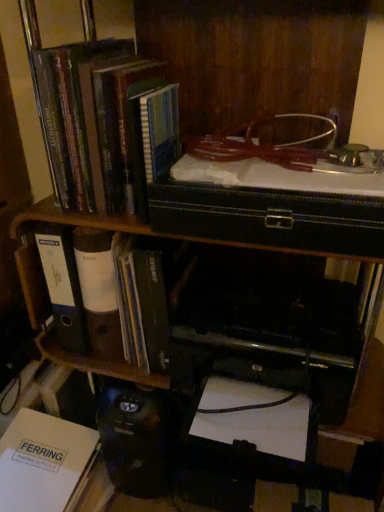
Consider the image. Measure the distance between black plastic printer at lower center and camera.

The distance of black plastic printer at lower center from camera is 29.74 inches.

What do you see at coordinates (143, 298) in the screenshot? The width and height of the screenshot is (384, 512). I see `white paper folder at left, positioned as the 2th book in bottom-to-top order` at bounding box center [143, 298].

Locate an element on the screen. The height and width of the screenshot is (512, 384). white paper at lower left, placed as the 1th book when sorted from bottom to top is located at coordinates (42, 462).

From a real-world perspective, which object stands above the other?

white paper folder at left, the 2th book in the top-to-bottom sequence.

From the picture: Which is correct: white paper folder at left, the 2th book in the top-to-bottom sequence, is inside white paper at lower left, placed as the 1th book when sorted from bottom to top, or outside of it?

white paper folder at left, the 2th book in the top-to-bottom sequence, is not inside white paper at lower left, placed as the 1th book when sorted from bottom to top, it's outside.

From the image's perspective, between white paper folder at left, positioned as the 2th book in bottom-to-top order, and white paper at lower left, placed as the 1th book when sorted from bottom to top, which one is located above?

white paper folder at left, positioned as the 2th book in bottom-to-top order.

From a real-world perspective, relative to white paper at lower left, positioned as the 3th book in top-to-bottom order, is hardcover book at upper left, which is the first book from top to bottom, vertically above or below?

Clearly, from a real-world perspective, hardcover book at upper left, which is the first book from top to bottom, is above white paper at lower left, positioned as the 3th book in top-to-bottom order.

Is hardcover book at upper left, which is the first book from top to bottom, oriented towards white paper at lower left, positioned as the 3th book in top-to-bottom order?

No, hardcover book at upper left, which is the first book from top to bottom, is not oriented towards white paper at lower left, positioned as the 3th book in top-to-bottom order.

From the image's perspective, is hardcover book at upper left, the third book ordered from the bottom, above white paper at lower left, positioned as the 3th book in top-to-bottom order?

Yes, from the image's perspective, hardcover book at upper left, the third book ordered from the bottom, is above white paper at lower left, positioned as the 3th book in top-to-bottom order.

Between hardcover book at upper left, which is the first book from top to bottom, and white paper at lower left, placed as the 1th book when sorted from bottom to top, which one appears on the left side from the viewer's perspective?

From the viewer's perspective, white paper at lower left, placed as the 1th book when sorted from bottom to top, appears more on the left side.

Is black plastic printer at lower center facing towards white paper folder at left, positioned as the 2th book in bottom-to-top order?

No, black plastic printer at lower center is not aimed at white paper folder at left, positioned as the 2th book in bottom-to-top order.

Identify the location of printer that appears in front of the white paper folder at left, positioned as the 2th book in bottom-to-top order. The height and width of the screenshot is (512, 384). (268, 337).

Is black plastic printer at lower center wider or thinner than white paper folder at left, the 2th book in the top-to-bottom sequence?

Clearly, black plastic printer at lower center has more width compared to white paper folder at left, the 2th book in the top-to-bottom sequence.

Identify the location of the 2nd book in front of the white paper at lower left, positioned as the 3th book in top-to-bottom order, counting from the anchor's position. The image size is (384, 512). (85, 121).

Looking at their sizes, would you say white paper at lower left, positioned as the 3th book in top-to-bottom order, is wider or thinner than hardcover book at upper left, the third book ordered from the bottom?

In the image, white paper at lower left, positioned as the 3th book in top-to-bottom order, appears to be more narrow than hardcover book at upper left, the third book ordered from the bottom.

Does point (41, 478) appear closer or farther from the camera than point (138, 65)?

Clearly, point (41, 478) is more distant from the camera than point (138, 65).

Can you tell me how much white paper at lower left, placed as the 1th book when sorted from bottom to top, and hardcover book at upper left, the third book ordered from the bottom, differ in facing direction?

white paper at lower left, placed as the 1th book when sorted from bottom to top, and hardcover book at upper left, the third book ordered from the bottom, are facing 7.06 degrees away from each other.

Is white paper folder at left, the 2th book in the top-to-bottom sequence, shorter than black plastic printer at lower center?

No, white paper folder at left, the 2th book in the top-to-bottom sequence, is not shorter than black plastic printer at lower center.

This screenshot has width=384, height=512. Find the location of `book that is the 1st one when counting upward from the black plastic printer at lower center (from the image's perspective)`. book that is the 1st one when counting upward from the black plastic printer at lower center (from the image's perspective) is located at coordinates (143, 298).

Which object is closer to the camera taking this photo, white paper folder at left, the 2th book in the top-to-bottom sequence, or black plastic printer at lower center?

black plastic printer at lower center is more forward.

Considering the relative sizes of white paper folder at left, positioned as the 2th book in bottom-to-top order, and black plastic printer at lower center in the image provided, is white paper folder at left, positioned as the 2th book in bottom-to-top order, bigger than black plastic printer at lower center?

Incorrect, white paper folder at left, positioned as the 2th book in bottom-to-top order, is not larger than black plastic printer at lower center.

Is hardcover book at upper left, the third book ordered from the bottom, to the left of white paper folder at left, the 2th book in the top-to-bottom sequence, from the viewer's perspective?

Incorrect, hardcover book at upper left, the third book ordered from the bottom, is not on the left side of white paper folder at left, the 2th book in the top-to-bottom sequence.

Is the depth of hardcover book at upper left, the third book ordered from the bottom, less than that of white paper folder at left, positioned as the 2th book in bottom-to-top order?

Yes.

Can you confirm if hardcover book at upper left, which is the first book from top to bottom, is wider than white paper folder at left, the 2th book in the top-to-bottom sequence?

No.

Considering the relative sizes of hardcover book at upper left, the third book ordered from the bottom, and white paper folder at left, positioned as the 2th book in bottom-to-top order, in the image provided, is hardcover book at upper left, the third book ordered from the bottom, taller than white paper folder at left, positioned as the 2th book in bottom-to-top order,?

Indeed, hardcover book at upper left, the third book ordered from the bottom, has a greater height compared to white paper folder at left, positioned as the 2th book in bottom-to-top order.

Which is further, (189, 379) or (70, 431)?

Point (70, 431)

Which object is positioned more to the right, black plastic printer at lower center or white paper at lower left, placed as the 1th book when sorted from bottom to top?

black plastic printer at lower center.

The width and height of the screenshot is (384, 512). I want to click on the 2nd book behind the black plastic printer at lower center, starting your count from the anchor, so click(x=42, y=462).

Is black plastic printer at lower center not within white paper at lower left, positioned as the 3th book in top-to-bottom order?

black plastic printer at lower center is positioned outside white paper at lower left, positioned as the 3th book in top-to-bottom order.

Identify the location of book below the white paper folder at left, the 2th book in the top-to-bottom sequence (from a real-world perspective). This screenshot has height=512, width=384. (42, 462).

From the white paper at lower left, placed as the 1th book when sorted from bottom to top, count 2nd books forward and point to it. Please provide its 2D coordinates.

[(85, 121)]

Considering their positions, is white paper at lower left, placed as the 1th book when sorted from bottom to top, positioned closer to white paper folder at left, the 2th book in the top-to-bottom sequence, than black plastic printer at lower center?

black plastic printer at lower center is positioned closer to the anchor white paper folder at left, the 2th book in the top-to-bottom sequence.

Based on their spatial positions, is white paper folder at left, the 2th book in the top-to-bottom sequence, or black plastic printer at lower center further from white paper at lower left, positioned as the 3th book in top-to-bottom order?

Among the two, black plastic printer at lower center is located further to white paper at lower left, positioned as the 3th book in top-to-bottom order.

Which object lies further to the anchor point hardcover book at upper left, which is the first book from top to bottom, white paper at lower left, positioned as the 3th book in top-to-bottom order, or white paper folder at left, the 2th book in the top-to-bottom sequence?

white paper at lower left, positioned as the 3th book in top-to-bottom order.

From the image, which object appears to be farther from white paper at lower left, placed as the 1th book when sorted from bottom to top, hardcover book at upper left, the third book ordered from the bottom, or white paper folder at left, positioned as the 2th book in bottom-to-top order?

The object further to white paper at lower left, placed as the 1th book when sorted from bottom to top, is hardcover book at upper left, the third book ordered from the bottom.

Based on the photo, estimate the real-world distances between objects in this image. Which object is closer to white paper folder at left, the 2th book in the top-to-bottom sequence, black plastic printer at lower center or hardcover book at upper left, which is the first book from top to bottom?

Based on the image, black plastic printer at lower center appears to be nearer to white paper folder at left, the 2th book in the top-to-bottom sequence.

From the image, which object appears to be nearer to black plastic printer at lower center, hardcover book at upper left, which is the first book from top to bottom, or white paper folder at left, the 2th book in the top-to-bottom sequence?

Based on the image, white paper folder at left, the 2th book in the top-to-bottom sequence, appears to be nearer to black plastic printer at lower center.

Considering their positions, is hardcover book at upper left, which is the first book from top to bottom, positioned closer to white paper folder at left, positioned as the 2th book in bottom-to-top order, than black plastic printer at lower center?

Based on the image, black plastic printer at lower center appears to be nearer to white paper folder at left, positioned as the 2th book in bottom-to-top order.

From the image, which object appears to be farther from white paper at lower left, positioned as the 3th book in top-to-bottom order, hardcover book at upper left, the third book ordered from the bottom, or black plastic printer at lower center?

hardcover book at upper left, the third book ordered from the bottom, is positioned further to the anchor white paper at lower left, positioned as the 3th book in top-to-bottom order.

Where is `printer between hardcover book at upper left, which is the first book from top to bottom, and white paper at lower left, placed as the 1th book when sorted from bottom to top, vertically`? The width and height of the screenshot is (384, 512). printer between hardcover book at upper left, which is the first book from top to bottom, and white paper at lower left, placed as the 1th book when sorted from bottom to top, vertically is located at coordinates (268, 337).

Identify the location of book between hardcover book at upper left, which is the first book from top to bottom, and black plastic printer at lower center from top to bottom. (143, 298).

Locate an element on the screen. book that lies between hardcover book at upper left, which is the first book from top to bottom, and white paper at lower left, positioned as the 3th book in top-to-bottom order, from top to bottom is located at coordinates (143, 298).

Locate an element on the screen. printer between white paper folder at left, the 2th book in the top-to-bottom sequence, and white paper at lower left, placed as the 1th book when sorted from bottom to top, in the vertical direction is located at coordinates (268, 337).